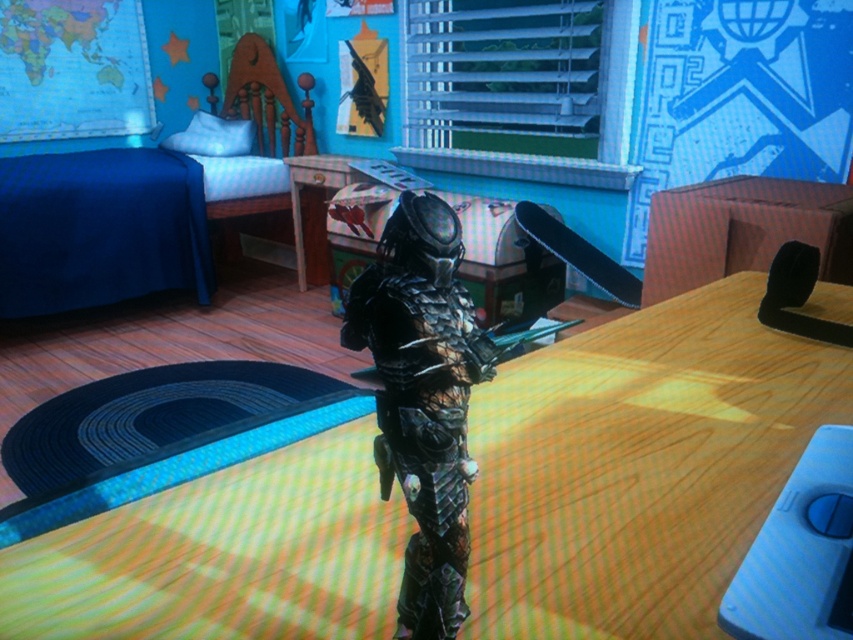
Question: Which point is closer to the camera?

Choices:
 (A) coord(459,529)
 (B) coord(265,621)

Answer: (A)

Question: Is the position of metallic silver table at center less distant than that of metallic black armor at center?

Choices:
 (A) yes
 (B) no

Answer: (B)

Question: Can you confirm if metallic silver table at center is thinner than metallic black armor at center?

Choices:
 (A) yes
 (B) no

Answer: (B)

Question: Does metallic silver table at center appear over metallic black armor at center?

Choices:
 (A) no
 (B) yes

Answer: (A)